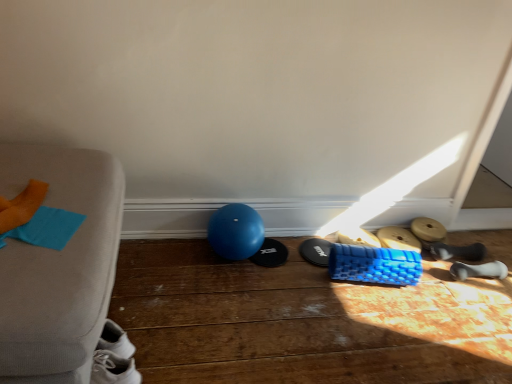
Where is `vacant area to the left of blue textured foam roller at center, which ranks as the 2th footwear in left-to-right order`? vacant area to the left of blue textured foam roller at center, which ranks as the 2th footwear in left-to-right order is located at coordinates (281, 258).